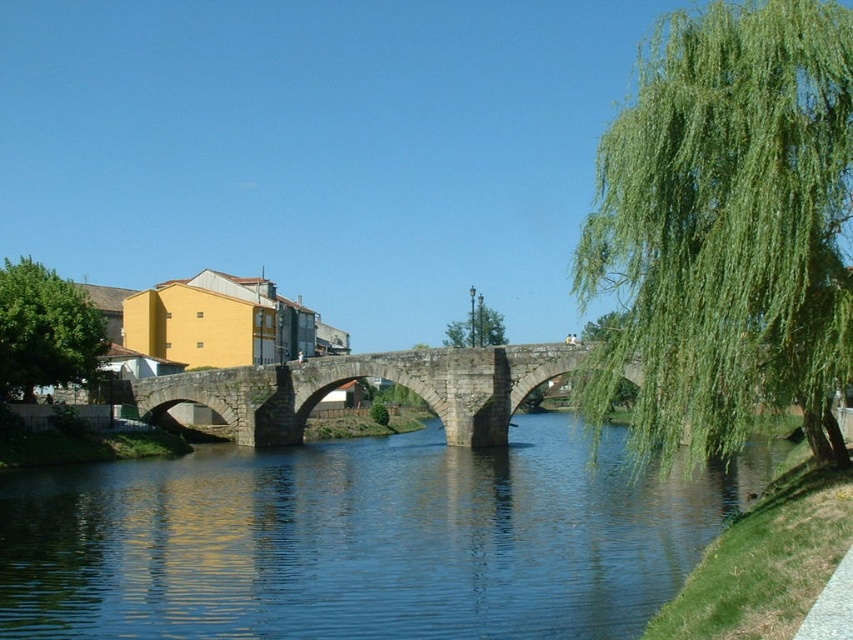
Does blue stone bridge at center appear on the left side of green leafy tree at left?

No, blue stone bridge at center is not to the left of green leafy tree at left.

In the scene shown: Does blue stone bridge at center have a lesser height compared to green leafy tree at left?

Yes.

The height and width of the screenshot is (640, 853). What do you see at coordinates (363, 540) in the screenshot?
I see `blue stone bridge at center` at bounding box center [363, 540].

Locate an element on the screen. The width and height of the screenshot is (853, 640). blue stone bridge at center is located at coordinates (363, 540).

Consider the image. Which is more to the right, green leafy tree at left or green leafy tree at upper right?

From the viewer's perspective, green leafy tree at upper right appears more on the right side.

Is point (28, 372) positioned before point (625, 323)?

No.

At what (x,y) coordinates should I click in order to perform the action: click on green leafy tree at left. Please return your answer as a coordinate pair (x, y). This screenshot has width=853, height=640. Looking at the image, I should click on (45, 330).

This screenshot has width=853, height=640. Find the location of `green leafy tree at left`. green leafy tree at left is located at coordinates (45, 330).

Who is more distant from viewer, (33, 275) or (479, 296)?

Positioned behind is point (479, 296).

You are a GUI agent. You are given a task and a screenshot of the screen. Output one action in this format:
    pyautogui.click(x=<x>, y=<y>)
    Task: Click on the green leafy tree at left
    
    Given the screenshot: What is the action you would take?
    pyautogui.click(x=45, y=330)

Find the location of `green leafy tree at left`. green leafy tree at left is located at coordinates (45, 330).